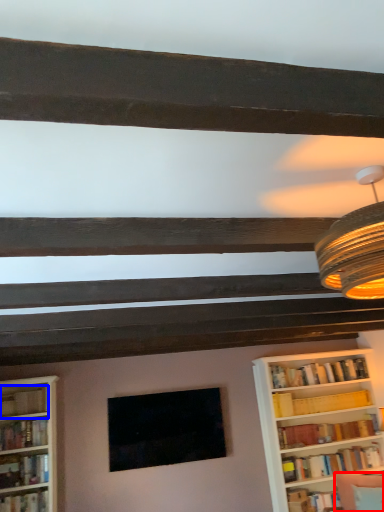
Question: Which object is further to the camera taking this photo, swivel chair (highlighted by a red box) or book (highlighted by a blue box)?

Choices:
 (A) swivel chair
 (B) book

Answer: (B)